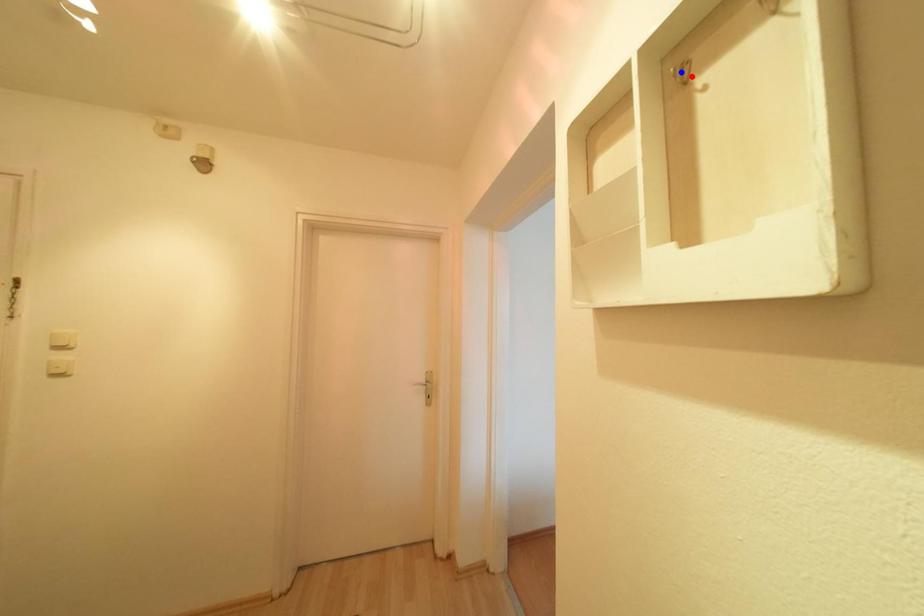
Question: Which of the two points in the image is closer to the camera?

Choices:
 (A) Blue point is closer.
 (B) Red point is closer.

Answer: (B)